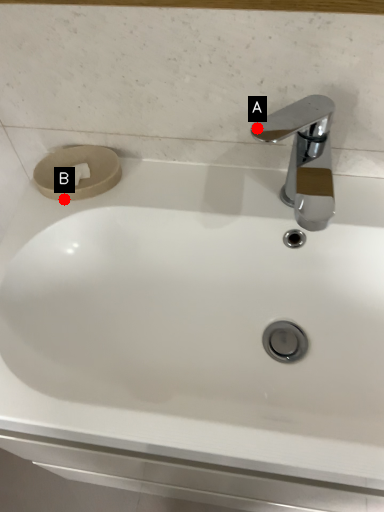
Question: Two points are circled on the image, labeled by A and B beside each circle. Which point appears farthest from the camera in this image?

Choices:
 (A) A is further
 (B) B is further

Answer: (B)